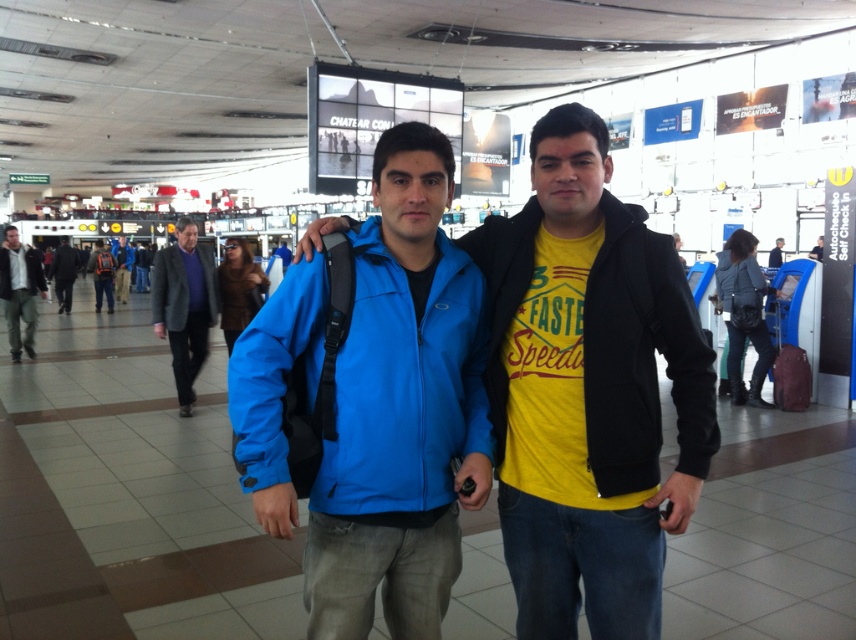
You are a photographer standing in the airport terminal. You want to take a closeup shot of the matte black jacket at left without moving your position. Is it possible to capture the entire jacket in the frame given that your camera has a maximum zoom range of 10 meters?

The matte black jacket at left is 10.38 meters from viewer. Since the camera can zoom up to 10 meters, it cannot fully capture the entire jacket in the frame as the distance exceeds the maximum zoom range.

You are a photographer taking a picture of two people in an airport terminal. You see the blue matte jacket at center and the dark gray suit at center. Which one is nearer to you?

The blue matte jacket at center is closer to the viewer than the dark gray suit at center.

From the picture: You are taking a photo of the two people in the airport scene. The two points in the image are located at coordinates point [210,321] and point [125,260]. Which point is closer to the camera?

Point [210,321] is closer to the camera than point [125,260].